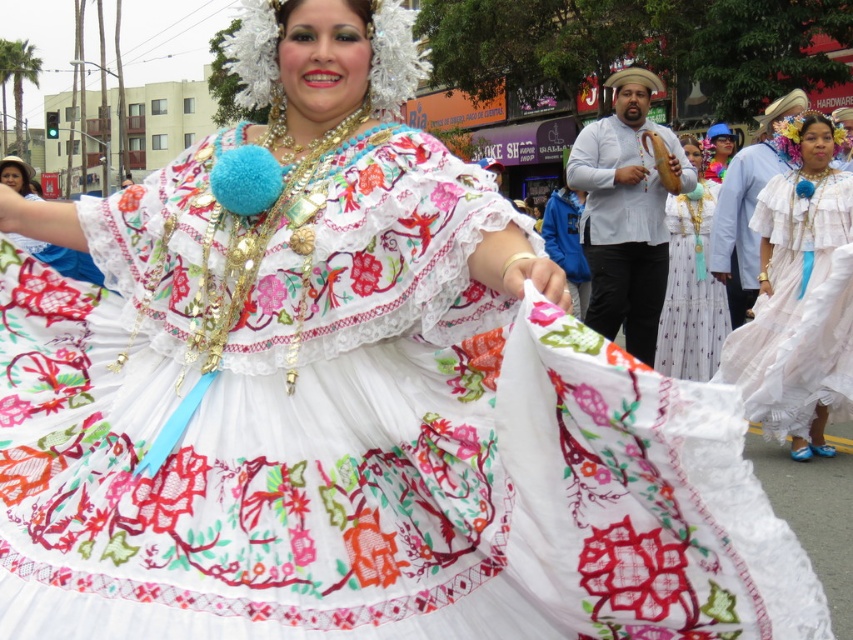
You are a photographer standing in front of the vibrant street scene. You notice two dresses at the center of the image. Which dress is taller, the white cotton dress at center or the white embroidered dress at center?

The white cotton dress at center is much taller than the white embroidered dress at center according to the description.

You are a photographer standing at a certain position and want to take a photo of the white cotton dress at center. If your camera has a maximum focus range of 7 meters, will you be able to focus on the dress?

The white cotton dress at center and camera are 7.48 meters apart, which exceeds the camera maximum focus range of 7 meters. Therefore, the camera cannot focus on the dress.

You are a photographer at the event and want to capture the woman in the white cotton dress at center and the white lace dress at center. Which dress is closer to the camera?

The white cotton dress at center is closer to the camera because it is in front of the white lace dress at center.